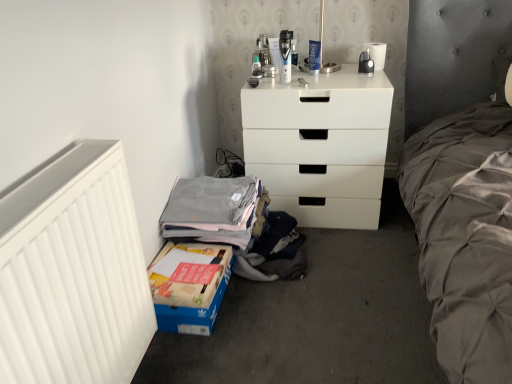
The image size is (512, 384). What are the coordinates of `unoccupied region to the right of blue cardboard box at lower left` in the screenshot? It's located at (262, 310).